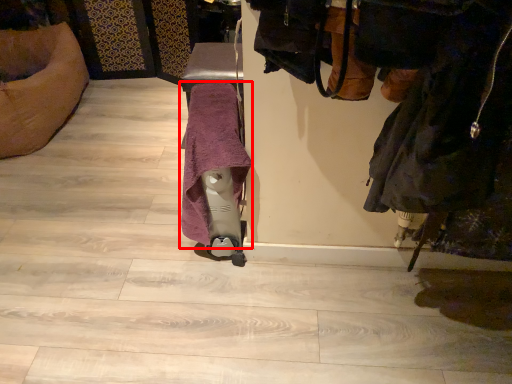
Question: From the image's perspective, where is bath towel (annotated by the red box) located relative to laundry?

Choices:
 (A) below
 (B) above

Answer: (A)